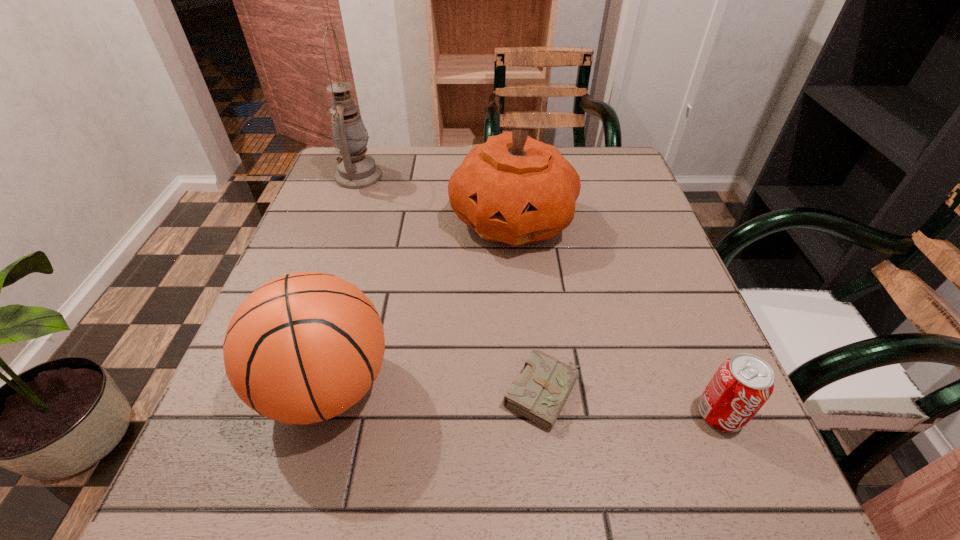
Select which object appears as the closest to the rightmost object. Please provide its 2D coordinates. Your answer should be formatted as a tuple, i.e. [(x, y)], where the tuple contains the x and y coordinates of a point satisfying the conditions above.

[(540, 393)]

Where is `vacant region that satisfies the following two spatial constraints: 1. on the front-facing side of the diary; 2. on the left side of the pumpkin`? The image size is (960, 540). vacant region that satisfies the following two spatial constraints: 1. on the front-facing side of the diary; 2. on the left side of the pumpkin is located at coordinates [527, 393].

Locate an element on the screen. This screenshot has width=960, height=540. free space that satisfies the following two spatial constraints: 1. on the front-facing side of the shortest object; 2. on the right side of the pumpkin is located at coordinates (527, 393).

The width and height of the screenshot is (960, 540). I want to click on free space that satisfies the following two spatial constraints: 1. on the front side of the shortest object; 2. on the left side of the soda, so click(x=545, y=414).